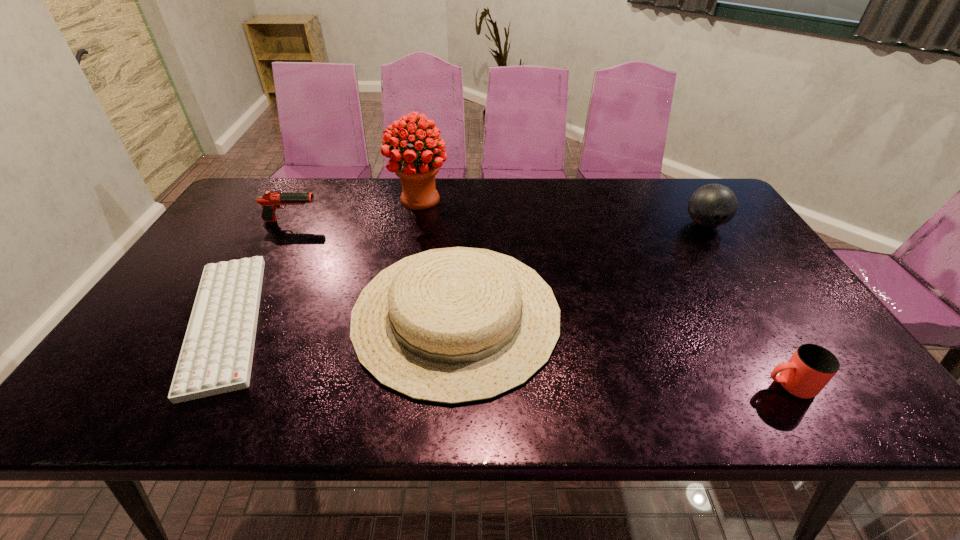
Identify the location of the third closest object to the bouquet. (216, 357).

At what (x,y) coordinates should I click in order to perform the action: click on vacant region that satisfies the following two spatial constraints: 1. on the front side of the sunhat; 2. on the handle side of the cup. Please return your answer as a coordinate pair (x, y). This screenshot has width=960, height=540. Looking at the image, I should click on (452, 386).

This screenshot has width=960, height=540. Identify the location of vacant space that satisfies the following two spatial constraints: 1. on the front side of the sunhat; 2. on the right side of the tallest object. (397, 314).

Image resolution: width=960 pixels, height=540 pixels. What are the coordinates of `free space in the image that satisfies the following two spatial constraints: 1. on the front side of the tallest object; 2. at the aiming end of the gun` in the screenshot? It's located at (416, 221).

Where is `free space that satisfies the following two spatial constraints: 1. at the aiming end of the gun; 2. on the handle side of the cup`? This screenshot has height=540, width=960. free space that satisfies the following two spatial constraints: 1. at the aiming end of the gun; 2. on the handle side of the cup is located at coordinates (201, 386).

Find the location of a particular element. This screenshot has width=960, height=540. free region that satisfies the following two spatial constraints: 1. at the aiming end of the sunhat; 2. on the right side of the gun is located at coordinates (240, 314).